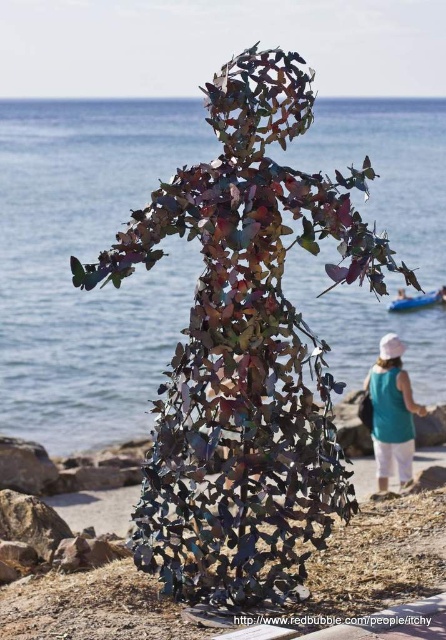
Question: Which point is closer to the camera?

Choices:
 (A) (264, 403)
 (B) (404, 392)

Answer: (A)

Question: Among these objects, which one is farthest from the camera?

Choices:
 (A) metallic leaf sculpture at center
 (B) teal fabric dress at lower right

Answer: (B)

Question: Does metallic leaf sculpture at center have a larger size compared to teal fabric dress at lower right?

Choices:
 (A) no
 (B) yes

Answer: (B)

Question: Is metallic leaf sculpture at center closer to the viewer compared to teal fabric dress at lower right?

Choices:
 (A) no
 (B) yes

Answer: (B)

Question: Does metallic leaf sculpture at center appear under teal fabric dress at lower right?

Choices:
 (A) yes
 (B) no

Answer: (B)